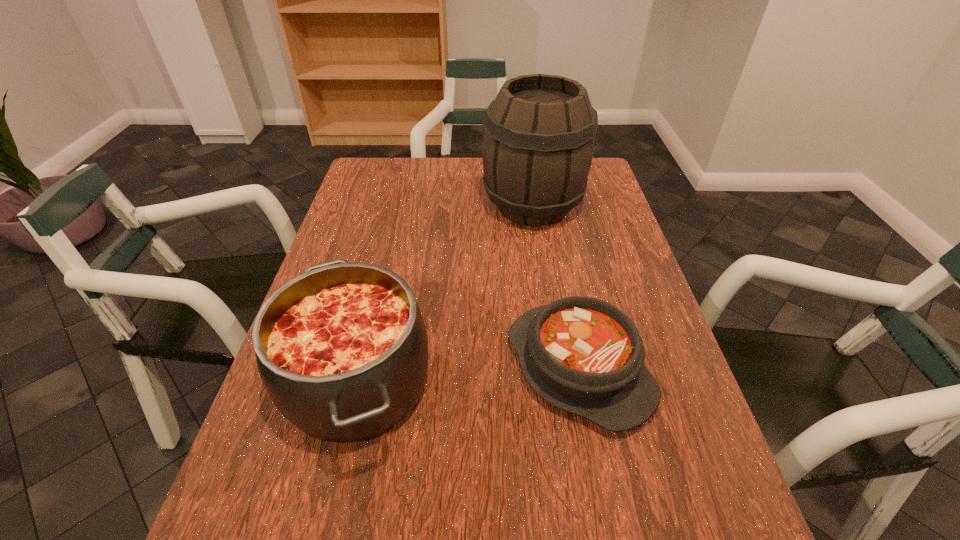
At what (x,y) coordinates should I click in order to perform the action: click on free space between the wine bucket and the shorter casserole. Please return your answer as a coordinate pair (x, y). Image resolution: width=960 pixels, height=540 pixels. Looking at the image, I should click on (556, 287).

Where is `free point between the left casserole and the right casserole`? The width and height of the screenshot is (960, 540). free point between the left casserole and the right casserole is located at coordinates (468, 375).

Where is `free space between the leftmost object and the wine bucket`? This screenshot has width=960, height=540. free space between the leftmost object and the wine bucket is located at coordinates (445, 294).

The image size is (960, 540). Find the location of `blank region between the wine bucket and the left casserole`. blank region between the wine bucket and the left casserole is located at coordinates (445, 294).

You are a GUI agent. You are given a task and a screenshot of the screen. Output one action in this format:
    pyautogui.click(x=<x>, y=<y>)
    Task: Click on the free space between the wine bucket and the taller casserole
    This screenshot has width=960, height=540.
    Given the screenshot: What is the action you would take?
    pyautogui.click(x=445, y=294)

I want to click on free point between the farthest object and the right casserole, so click(556, 287).

The width and height of the screenshot is (960, 540). Find the location of `free spot between the second tallest object and the shortest object`. free spot between the second tallest object and the shortest object is located at coordinates coord(468,375).

Locate an element on the screen. This screenshot has height=540, width=960. free space between the farthest object and the shortest object is located at coordinates (556, 287).

Select which object is the second closest to the shortest object. Please provide its 2D coordinates. Your answer should be formatted as a tuple, i.e. [(x, y)], where the tuple contains the x and y coordinates of a point satisfying the conditions above.

[(538, 143)]

At what (x,y) coordinates should I click in order to perform the action: click on object that stands as the second closest to the taller casserole. Please return your answer as a coordinate pair (x, y). This screenshot has height=540, width=960. Looking at the image, I should click on (538, 143).